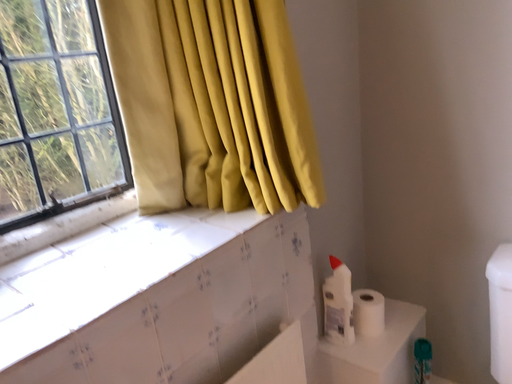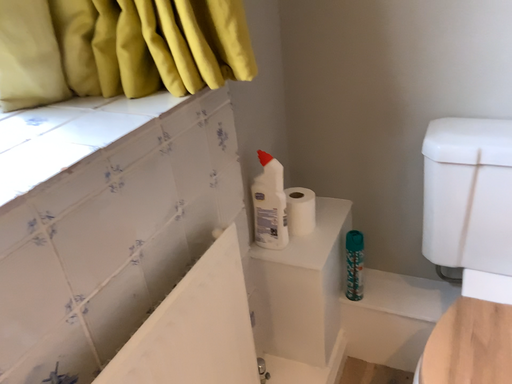
Question: How did the camera likely rotate when shooting the video?

Choices:
 (A) rotated upward
 (B) rotated downward

Answer: (B)